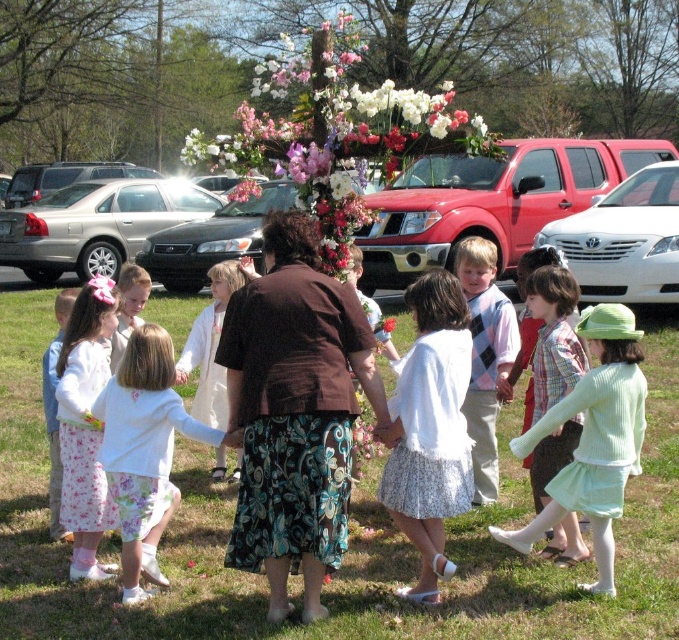
Question: Considering the relative positions of floral arrangement at center and light green knit sweater at center in the image provided, where is floral arrangement at center located with respect to light green knit sweater at center?

Choices:
 (A) above
 (B) below

Answer: (A)

Question: Estimate the real-world distances between objects in this image. Which object is farther from the floral arrangement at center?

Choices:
 (A) light green knit sweater at center
 (B) light green fabric dress at lower right

Answer: (B)

Question: From the image, what is the correct spatial relationship of white floral skirt at center in relation to argyle sweater vest at center?

Choices:
 (A) left
 (B) right

Answer: (A)

Question: Which object is closer to the camera taking this photo?

Choices:
 (A) white pleated skirt at center
 (B) floral cotton dress at lower left

Answer: (A)

Question: Which is nearer to the light green knit sweater at center?

Choices:
 (A) white floral skirt at center
 (B) floral cotton dress at lower left
 (C) brown fabric skirt at center
 (D) argyle sweater vest at center

Answer: (D)

Question: Where is white floral skirt at center located in relation to floral cotton dress at lower left in the image?

Choices:
 (A) left
 (B) right

Answer: (B)